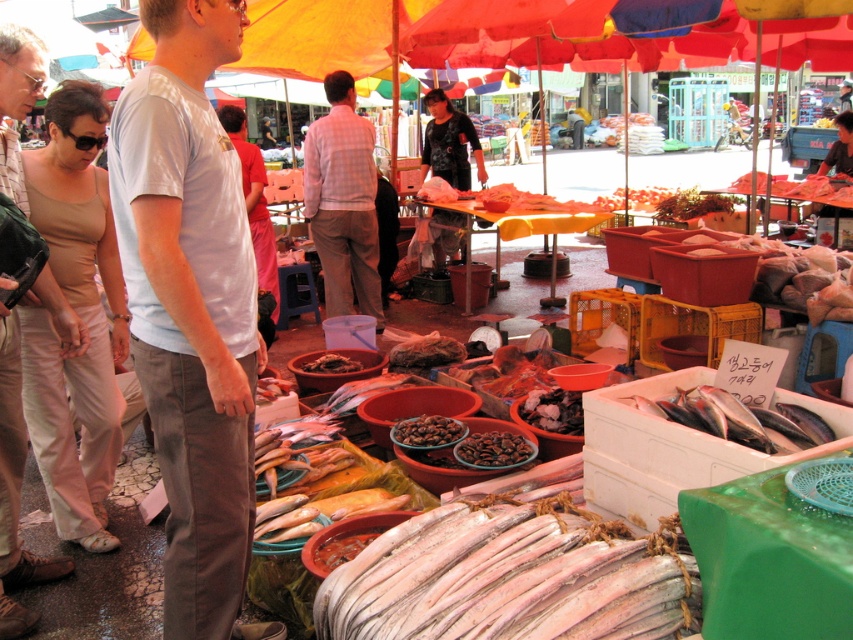
You are a customer at the market and want to approach the vendor standing behind the light blue cotton shirt at center and the light pink checkered shirt at center. Which shirt should you look at first to find the vendor?

The light blue cotton shirt at center is in front of the light pink checkered shirt at center, so you should look at the light blue cotton shirt at center first as it is closer to you.

You are standing at the point marked by the coordinate point at (253, 333) and want to reach the entrance of the market located at the opposite side. There is a vendor cart blocking your path. The vendor cart is exactly halfway between your current position and the entrance. Can you walk around the vendor cart to reach the entrance?

Since the vendor cart is exactly halfway between your current position and the entrance, and the distance between you and the entrance is 7.18 feet, the distance from you to the cart is 3.59 feet. To navigate around the cart, you would need to detour around it. Assuming the cart has a standard width of about 2 feet, you can walk around it either to the left or right, adding approximately 2 feet to your path. This would make the total distance to the entrance roughly 3.59 feet plus 2 feet, totaling about 5.5